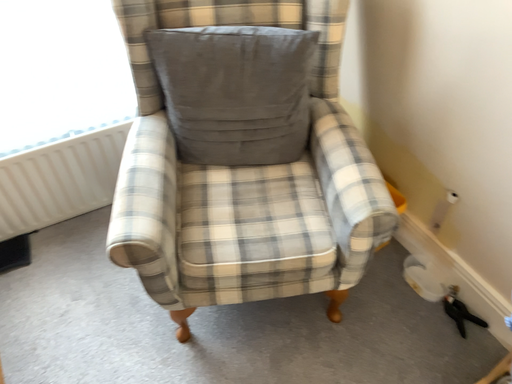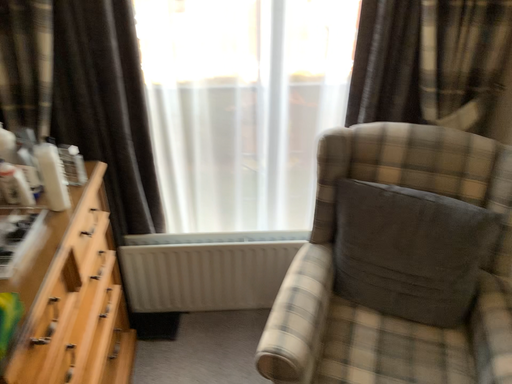
Question: How did the camera likely rotate when shooting the video?

Choices:
 (A) rotated left
 (B) rotated right

Answer: (A)